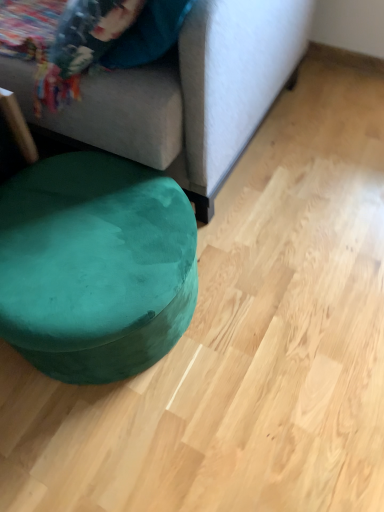
Measure the distance between suede gray couch at upper left and camera.

suede gray couch at upper left is 31.71 inches from camera.

In order to click on suede gray couch at upper left in this screenshot , I will do `click(187, 93)`.

In order to face suede gray couch at upper left, should I rotate leftwards or rightwards?

Turn left by 19.279 degrees to look at suede gray couch at upper left.

What do you see at coordinates (187, 93) in the screenshot? The image size is (384, 512). I see `suede gray couch at upper left` at bounding box center [187, 93].

Describe the element at coordinates (95, 266) in the screenshot. I see `velvet green bean bag at lower left` at that location.

Where is `velvet green bean bag at lower left`? velvet green bean bag at lower left is located at coordinates (95, 266).

Locate an element on the screen. Image resolution: width=384 pixels, height=512 pixels. suede gray couch at upper left is located at coordinates [187, 93].

Which object is positioned more to the right, velvet green bean bag at lower left or suede gray couch at upper left?

Positioned to the right is velvet green bean bag at lower left.

Is velvet green bean bag at lower left positioned in front of suede gray couch at upper left?

That is False.

Which point is more forward, (106, 330) or (195, 89)?

The point (106, 330) is closer to the camera.

From the image's perspective, which is above, velvet green bean bag at lower left or suede gray couch at upper left?

suede gray couch at upper left is shown above in the image.

Based on the photo, from a real-world perspective, is velvet green bean bag at lower left located beneath suede gray couch at upper left?

Yes.

Is velvet green bean bag at lower left thinner than suede gray couch at upper left?

Correct, the width of velvet green bean bag at lower left is less than that of suede gray couch at upper left.

Who is taller, velvet green bean bag at lower left or suede gray couch at upper left?

Standing taller between the two is suede gray couch at upper left.

Is velvet green bean bag at lower left bigger than suede gray couch at upper left?

Actually, velvet green bean bag at lower left might be smaller than suede gray couch at upper left.

Is suede gray couch at upper left surrounded by velvet green bean bag at lower left?

Definitely not — suede gray couch at upper left is not inside velvet green bean bag at lower left.

Is there a large distance between velvet green bean bag at lower left and suede gray couch at upper left?

No, there isn't a large distance between velvet green bean bag at lower left and suede gray couch at upper left.

Is velvet green bean bag at lower left looking in the opposite direction of suede gray couch at upper left?

Correct, velvet green bean bag at lower left is looking away from suede gray couch at upper left.

What's the angular difference between velvet green bean bag at lower left and suede gray couch at upper left's facing directions?

They differ by 0.824 degrees in their facing directions.

How far apart are velvet green bean bag at lower left and suede gray couch at upper left?

The distance of velvet green bean bag at lower left from suede gray couch at upper left is 11.83 inches.

This screenshot has width=384, height=512. In order to click on studio couch above the velvet green bean bag at lower left (from a real-world perspective) in this screenshot , I will do `click(187, 93)`.

Considering the relative positions of suede gray couch at upper left and velvet green bean bag at lower left in the image provided, is suede gray couch at upper left to the left or to the right of velvet green bean bag at lower left?

From the image, it's evident that suede gray couch at upper left is to the left of velvet green bean bag at lower left.

Which is in front, suede gray couch at upper left or velvet green bean bag at lower left?

suede gray couch at upper left is closer to the camera.

Does point (209, 125) come closer to viewer compared to point (188, 306)?

Yes, it is.

From the image's perspective, is suede gray couch at upper left over velvet green bean bag at lower left?

Yes, from the image's perspective, suede gray couch at upper left is on top of velvet green bean bag at lower left.

From a real-world perspective, is suede gray couch at upper left located beneath velvet green bean bag at lower left?

No.

Considering the sizes of objects suede gray couch at upper left and velvet green bean bag at lower left in the image provided, who is thinner, suede gray couch at upper left or velvet green bean bag at lower left?

Thinner between the two is velvet green bean bag at lower left.

Considering the sizes of objects suede gray couch at upper left and velvet green bean bag at lower left in the image provided, who is shorter, suede gray couch at upper left or velvet green bean bag at lower left?

velvet green bean bag at lower left is shorter.

Between suede gray couch at upper left and velvet green bean bag at lower left, which one has smaller size?

velvet green bean bag at lower left.

Is velvet green bean bag at lower left a part of suede gray couch at upper left?

No, suede gray couch at upper left does not contain velvet green bean bag at lower left.

Can you see suede gray couch at upper left touching velvet green bean bag at lower left?

They are not placed beside each other.

Looking at this image, is suede gray couch at upper left looking in the opposite direction of velvet green bean bag at lower left?

suede gray couch at upper left is not turned away from velvet green bean bag at lower left.

How many degrees apart are the facing directions of suede gray couch at upper left and velvet green bean bag at lower left?

The angle between the facing direction of suede gray couch at upper left and the facing direction of velvet green bean bag at lower left is 0.824 degrees.

Where is `bean bag chair located below the suede gray couch at upper left (from the image's perspective)`? bean bag chair located below the suede gray couch at upper left (from the image's perspective) is located at coordinates (95, 266).

Locate an element on the screen. This screenshot has width=384, height=512. bean bag chair below the suede gray couch at upper left (from a real-world perspective) is located at coordinates (95, 266).

At what (x,y) coordinates should I click in order to perform the action: click on studio couch above the velvet green bean bag at lower left (from the image's perspective). Please return your answer as a coordinate pair (x, y). Looking at the image, I should click on (187, 93).